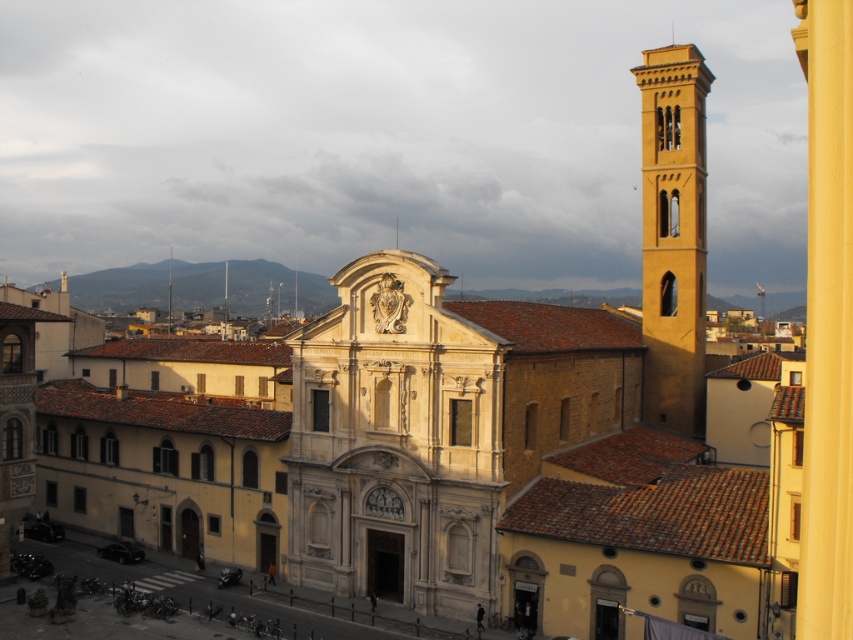
You are a tourist standing at the entrance of the city park, which is located at point 0,0. You want to take a photo of the white stone church at center. If you move 0.692 units to the right and 0.465 units forward, will you be facing the correct direction to capture the church in your camera view?

Yes, moving 0.692 units to the right and 0.465 units forward will position you correctly to face the white stone church at center since its coordinates are at point [396,442].

You are an architect evaluating the spatial compatibility of the buildings in the scene. Given that the white stone church at center and the matte yellow bell tower at right are key structures, which one has a greater height?

The matte yellow bell tower at right is taller than the white stone church at center, so the bell tower has a greater height.

You are standing at the coordinates point 0.5, 0.5 in the image. Which direction should you move to reach the white stone church at center?

Since the white stone church at center is located at point (396, 442), and you are at point (426, 320), you should move northeast to reach it.